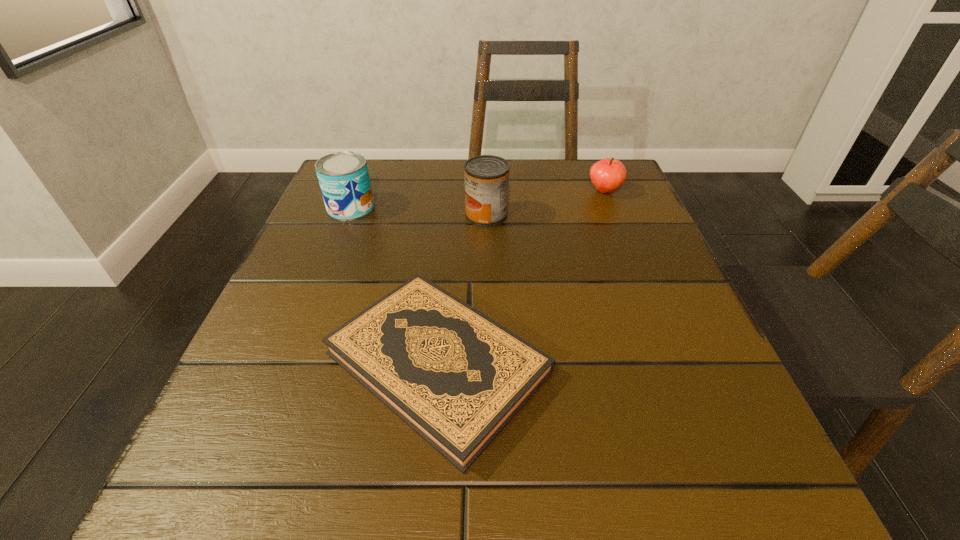
Locate an element on the screen. the right can is located at coordinates (486, 177).

Identify the location of the left can. (343, 176).

This screenshot has width=960, height=540. Find the location of `the rightmost object`. the rightmost object is located at coordinates (607, 175).

Where is `the third tallest object`? the third tallest object is located at coordinates (607, 175).

Identify the location of hardback book. This screenshot has width=960, height=540. (455, 376).

This screenshot has height=540, width=960. I want to click on the shortest object, so click(455, 376).

At what (x,y) coordinates should I click in order to perform the action: click on vacant space located on the right of the right can. Please return your answer as a coordinate pair (x, y). This screenshot has height=540, width=960. Looking at the image, I should click on (x=585, y=215).

The image size is (960, 540). Identify the location of free space located 0.260m on the right of the leftmost object. (496, 207).

At what (x,y) coordinates should I click in order to perform the action: click on free point located 0.300m on the front of the rightmost object. Please return your answer as a coordinate pair (x, y). This screenshot has width=960, height=540. Looking at the image, I should click on (647, 298).

This screenshot has width=960, height=540. I want to click on vacant space situated 0.370m on the back of the shortest object, so tap(454, 178).